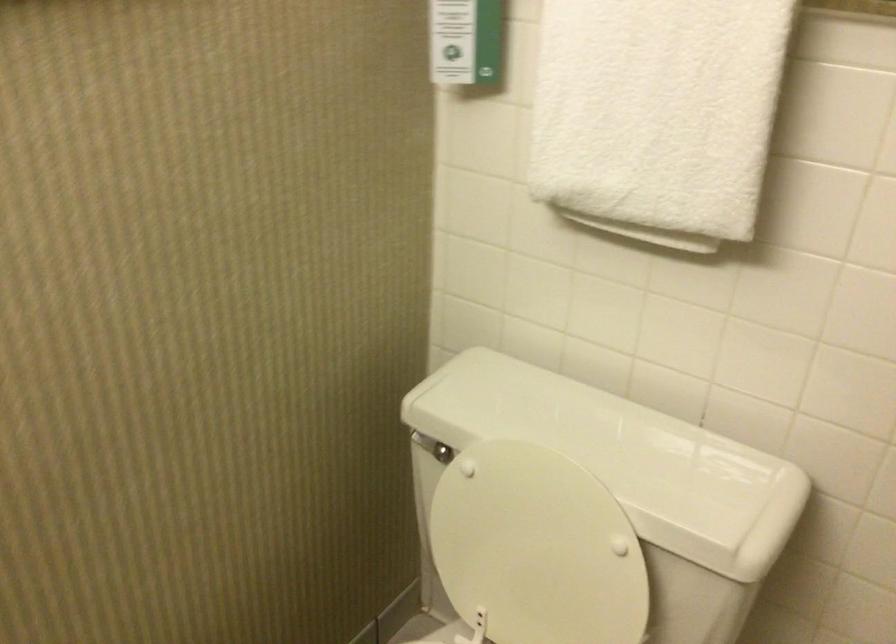
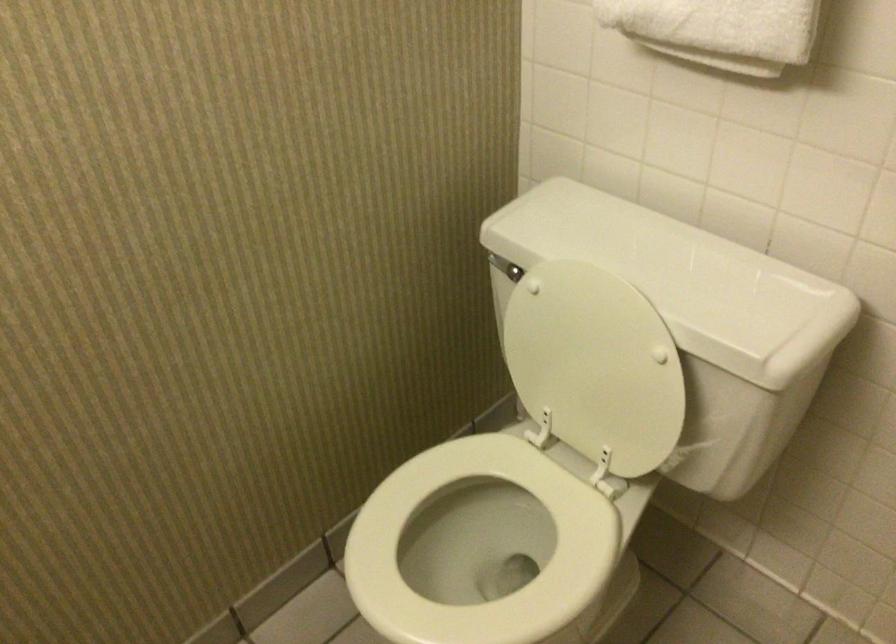
Which direction would the cameraman need to move to produce the second image?

The cameraman walked toward right, backward.